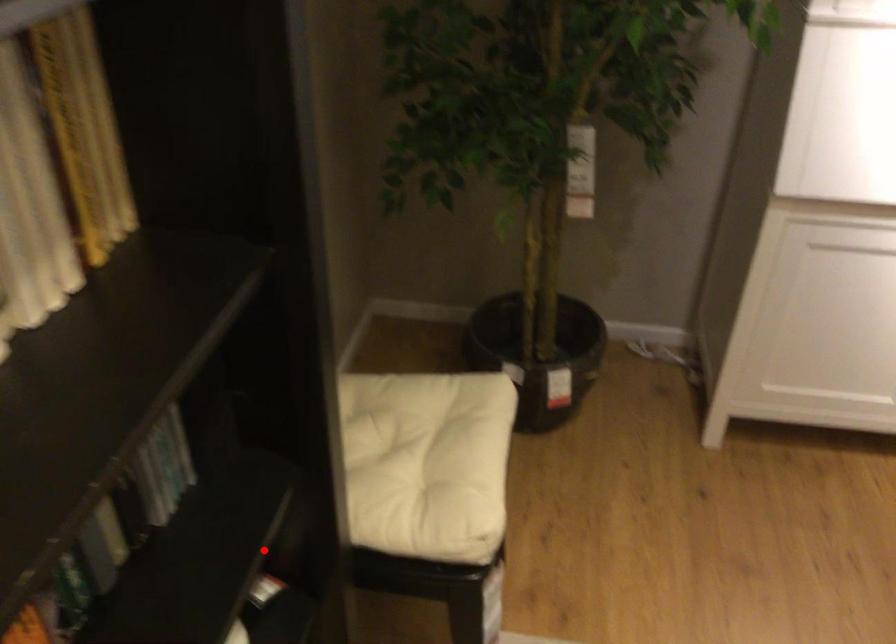
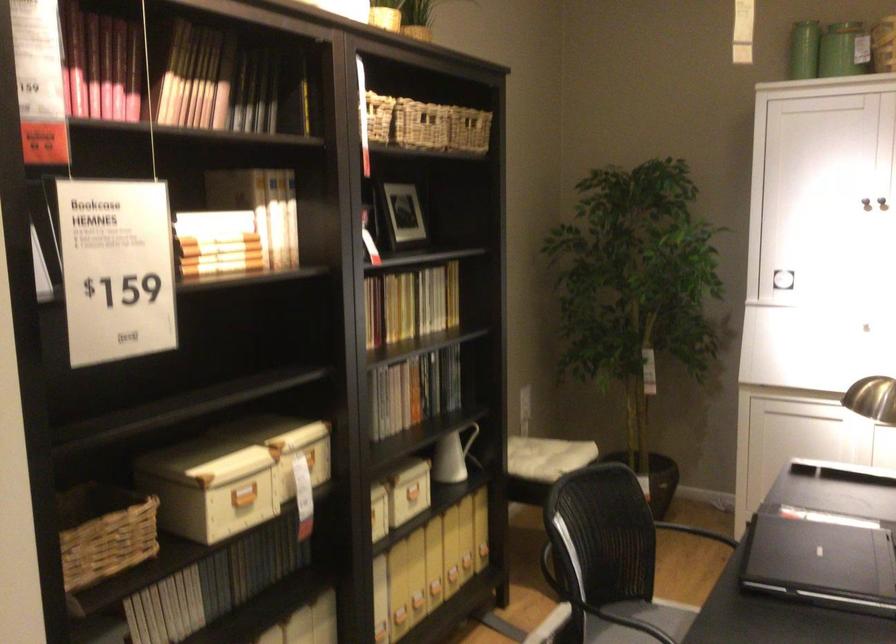
Where in the second image is the point corresponding to the highlighted location from the first image?

(474, 444)